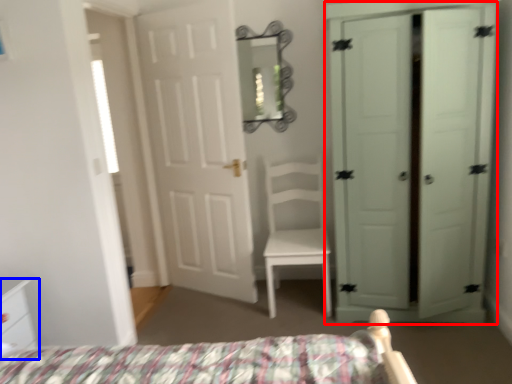
Question: Among these objects, which one is farthest to the camera, door (highlighted by a red box) or nightstand (highlighted by a blue box)?

Choices:
 (A) door
 (B) nightstand

Answer: (A)